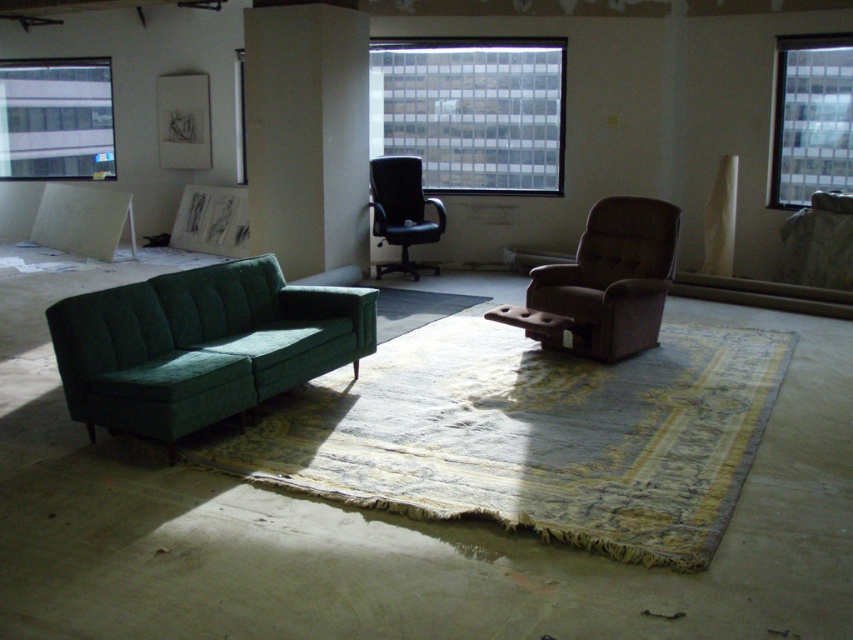
Question: In this image, where is green fabric couch at upper left located relative to clear glass window at upper left?

Choices:
 (A) right
 (B) left

Answer: (A)

Question: Which object is farther from the camera taking this photo?

Choices:
 (A) clear glass window at upper right
 (B) green fabric couch at left

Answer: (A)

Question: Which object appears closest to the camera in this image?

Choices:
 (A) brown suede recliner at center
 (B) green fabric couch at left
 (C) black leather office chair at center
 (D) clear glass window at upper left

Answer: (B)

Question: Does green fabric couch at upper left have a greater width compared to black leather office chair at center?

Choices:
 (A) yes
 (B) no

Answer: (A)

Question: Among these points, which one is farthest from the camera?

Choices:
 (A) (99, 307)
 (B) (4, 128)

Answer: (B)

Question: Is green fabric couch at left in front of clear glass window at center?

Choices:
 (A) yes
 (B) no

Answer: (A)